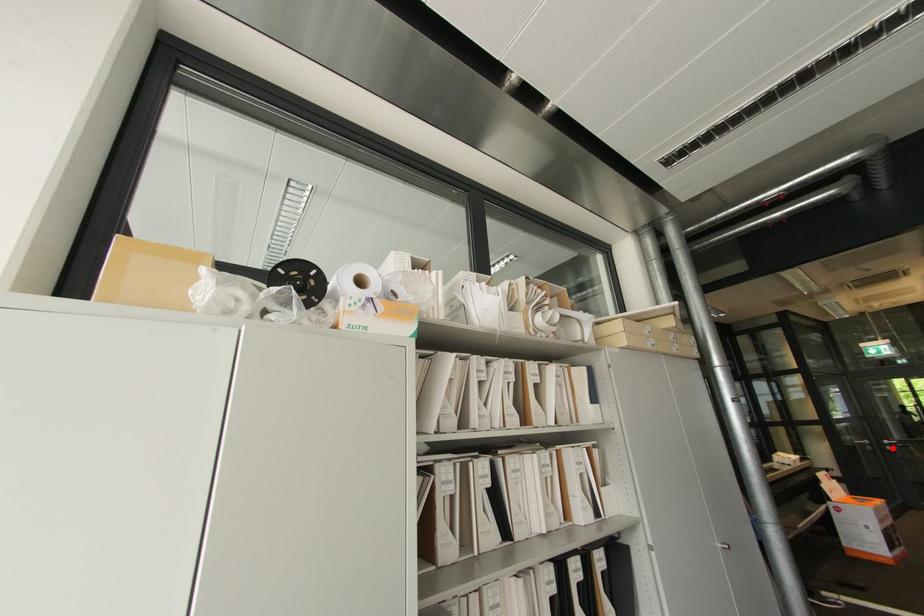
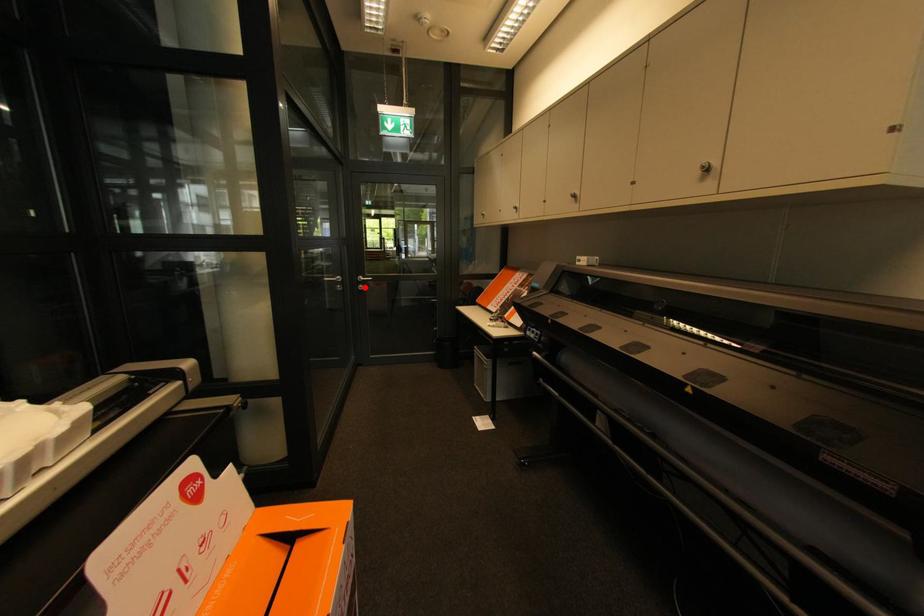
Looking at this image, I am providing you with two images of the same scene from different viewpoints. A red point is marked on the first image and another point is marked on the second image. Is the marked point in image1 the same physical position as the marked point in image2?

Yes